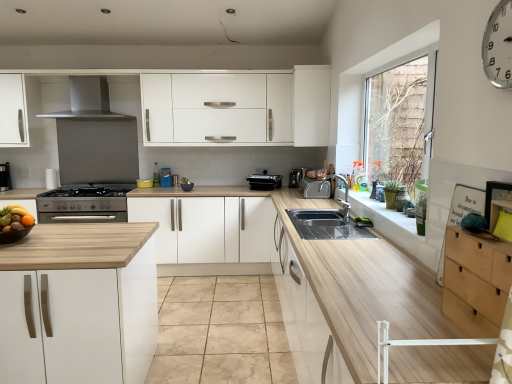
Measure the distance between point [267,186] and camera.

A distance of 4.76 meters exists between point [267,186] and camera.

Locate an element on the screen. satin silver stove at lower left, which is the first appliance in left-to-right order is located at coordinates (84, 203).

Does point (331, 268) come farther from viewer compared to point (447, 249)?

Yes, point (331, 268) is farther from viewer.

Can we say wooden at left lies outside beech wood drawer at right, marked as the third cabinetry in a back-to-front arrangement?

That's correct, wooden at left is outside of beech wood drawer at right, marked as the third cabinetry in a back-to-front arrangement.

Is wooden at left smaller than beech wood drawer at right, which appears as the first cabinetry when viewed from the front?

Actually, wooden at left might be larger than beech wood drawer at right, which appears as the first cabinetry when viewed from the front.

Identify the location of countertop that is on the left side of beech wood drawer at right, which is the 2th cabinetry from top to bottom. The image size is (512, 384). (349, 281).

From the image's perspective, between black matte bowl at left and satin silver toaster at center, positioned as the third appliance in left-to-right order, who is located below?

From the image's view, black matte bowl at left is below.

Which is behind, black matte bowl at left or satin silver toaster at center, positioned as the third appliance in left-to-right order?

satin silver toaster at center, positioned as the third appliance in left-to-right order, is more distant.

Which of these two, black matte bowl at left or satin silver toaster at center, which is counted as the 1th appliance, starting from the right, is smaller?

Smaller between the two is black matte bowl at left.

Measure the distance between black matte bowl at left and satin silver toaster at center, which is counted as the 1th appliance, starting from the right.

They are 8.90 feet apart.

What's the angular difference between black matte bowl at left and stainless steel exhaust hood at upper center's facing directions?

black matte bowl at left and stainless steel exhaust hood at upper center are facing 0.933 degrees away from each other.

Considering the points (19, 238) and (55, 112), which point is in front, point (19, 238) or point (55, 112)?

The point (19, 238) is in front.

Between black matte bowl at left and stainless steel exhaust hood at upper center, which one has smaller width?

Thinner between the two is black matte bowl at left.

Considering the relative sizes of black matte bowl at left and stainless steel exhaust hood at upper center in the image provided, is black matte bowl at left bigger than stainless steel exhaust hood at upper center?

No, black matte bowl at left is not bigger than stainless steel exhaust hood at upper center.

Is satin silver toaster at center outside of white matte cabinet at center, the 1th cabinetry from the left?

satin silver toaster at center is positioned outside white matte cabinet at center, the 1th cabinetry from the left.

Is satin silver toaster at center at the right side of white matte cabinet at center, the 1th cabinetry from the left?

Yes, satin silver toaster at center is to the right of white matte cabinet at center, the 1th cabinetry from the left.

Is satin silver toaster at center aimed at white matte cabinet at center, which is counted as the 3th cabinetry, starting from the right?

No, satin silver toaster at center is not oriented towards white matte cabinet at center, which is counted as the 3th cabinetry, starting from the right.

Looking at their sizes, would you say satin silver toaster at center is wider or thinner than white matte cabinet at center, the 1th cabinetry from the left?

satin silver toaster at center is thinner than white matte cabinet at center, the 1th cabinetry from the left.

Is white metallic clock at upper right taller than white matte cabinet at center, the 1th cabinetry from the left?

In fact, white metallic clock at upper right may be shorter than white matte cabinet at center, the 1th cabinetry from the left.

Is white metallic clock at upper right not inside white matte cabinet at center, which is counted as the 3th cabinetry, starting from the right?

white metallic clock at upper right lies outside white matte cabinet at center, which is counted as the 3th cabinetry, starting from the right,'s area.

Between white metallic clock at upper right and white matte cabinet at center, positioned as the third cabinetry in front-to-back order, which one appears on the right side from the viewer's perspective?

From the viewer's perspective, white metallic clock at upper right appears more on the right side.

From a real-world perspective, who is located higher, white metallic clock at upper right or white matte cabinet at center, which is counted as the 3th cabinetry, starting from the right?

white metallic clock at upper right, from a real-world perspective.

Is satin silver toaster at center, positioned as the third appliance in left-to-right order, wider than white matte cabinet at upper center, which appears as the 2th cabinetry when viewed from the back?

In fact, satin silver toaster at center, positioned as the third appliance in left-to-right order, might be narrower than white matte cabinet at upper center, which appears as the 2th cabinetry when viewed from the back.

Consider the image. What's the angular difference between satin silver toaster at center, positioned as the third appliance in left-to-right order, and white matte cabinet at upper center, acting as the third cabinetry starting from the bottom,'s facing directions?

89.7 degrees separate the facing orientations of satin silver toaster at center, positioned as the third appliance in left-to-right order, and white matte cabinet at upper center, acting as the third cabinetry starting from the bottom.

In terms of size, does satin silver toaster at center, positioned as the third appliance in left-to-right order, appear bigger or smaller than white matte cabinet at upper center, which ranks as the second cabinetry in front-to-back order?

Considering their sizes, satin silver toaster at center, positioned as the third appliance in left-to-right order, takes up less space than white matte cabinet at upper center, which ranks as the second cabinetry in front-to-back order.

From the stainless steel exhaust hood at upper center, count 2nd appliances backward and point to it. Please provide its 2D coordinates.

[(264, 181)]

From the image's perspective, would you say black plastic toaster at center, which is the second appliance from left to right, is shown under stainless steel exhaust hood at upper center?

Yes.

Is black plastic toaster at center, the second appliance when ordered from right to left, positioned with its back to stainless steel exhaust hood at upper center?

No, stainless steel exhaust hood at upper center is not at the back of black plastic toaster at center, the second appliance when ordered from right to left.

Is black plastic toaster at center, which is the second appliance from left to right, next to stainless steel exhaust hood at upper center?

A: No, black plastic toaster at center, which is the second appliance from left to right, is not in contact with stainless steel exhaust hood at upper center.

Starting from the wooden at left, which cabinetry is the 1st one behind? Please provide its 2D coordinates.

[(475, 282)]

Find the location of a particular element. bowl to the left of satin silver toaster at center, which is counted as the 1th appliance, starting from the right is located at coordinates (14, 234).

Which object lies nearer to the anchor point beige marble granite at center, beech wood drawer at right, marked as the second cabinetry in a bottom-to-top arrangement, or satin silver stove at lower left, which is the first appliance in left-to-right order?

satin silver stove at lower left, which is the first appliance in left-to-right order, is closer to beige marble granite at center.

When comparing their distances from shiny metallic bowl at left, does beech wood drawer at right, marked as the second cabinetry in a bottom-to-top arrangement, or stainless steel exhaust hood at upper center seem closer?

beech wood drawer at right, marked as the second cabinetry in a bottom-to-top arrangement.

Based on their spatial positions, is wooden at left or beech wood drawer at right, marked as the second cabinetry in a bottom-to-top arrangement, closer to black matte bowl at left?

Among the two, wooden at left is located nearer to black matte bowl at left.

When comparing their distances from stainless steel exhaust hood at upper center, does white matte cabinet at center, positioned as the third cabinetry in front-to-back order, or white metallic clock at upper right seem further?

Based on the image, white metallic clock at upper right appears to be further to stainless steel exhaust hood at upper center.

Based on their spatial positions, is satin silver stove at lower left, the 3th appliance in the right-to-left sequence, or stainless steel exhaust hood at upper center closer to beige marble granite at center?

Based on the image, satin silver stove at lower left, the 3th appliance in the right-to-left sequence, appears to be nearer to beige marble granite at center.

From the image, which object appears to be nearer to black plastic toaster at center, which is the second appliance from left to right, shiny metallic bowl at left or stainless steel exhaust hood at upper center?

stainless steel exhaust hood at upper center is closer to black plastic toaster at center, which is the second appliance from left to right.

Which object lies further to the anchor point black plastic toaster at center, which is the second appliance from left to right, stainless steel exhaust hood at upper center or silver metallic tap at sink right?

Among the two, stainless steel exhaust hood at upper center is located further to black plastic toaster at center, which is the second appliance from left to right.

Considering their positions, is satin silver toaster at center positioned closer to shiny metallic bowl at left than white metallic clock at upper right?

satin silver toaster at center is closer to shiny metallic bowl at left.

Image resolution: width=512 pixels, height=384 pixels. I want to click on bowl between shiny metallic bowl at left and black plastic toaster at center, which is the second appliance from left to right, from front to back, so click(14, 234).

Locate an element on the screen. The image size is (512, 384). clock between beech wood drawer at right, marked as the second cabinetry in a bottom-to-top arrangement, and satin silver toaster at center, along the z-axis is located at coordinates (498, 46).

At what (x,y) coordinates should I click in order to perform the action: click on tap between wooden at left and white matte cabinet at center, the 1th cabinetry from the left, in the front-back direction. Please return your answer as a coordinate pair (x, y). Image resolution: width=512 pixels, height=384 pixels. Looking at the image, I should click on pyautogui.click(x=344, y=195).

In order to click on toaster between white metallic clock at upper right and stainless steel exhaust hood at upper center along the z-axis in this screenshot , I will do `click(314, 188)`.